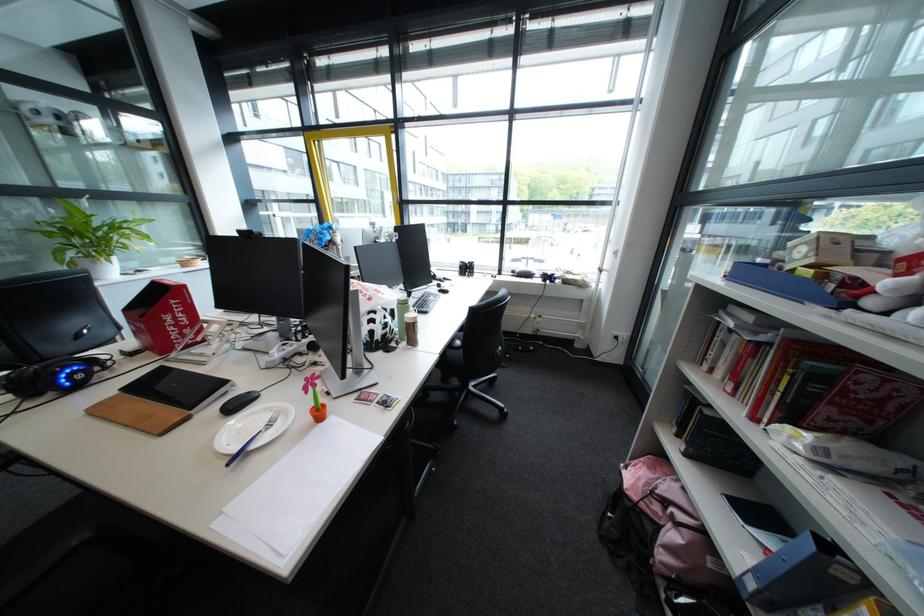
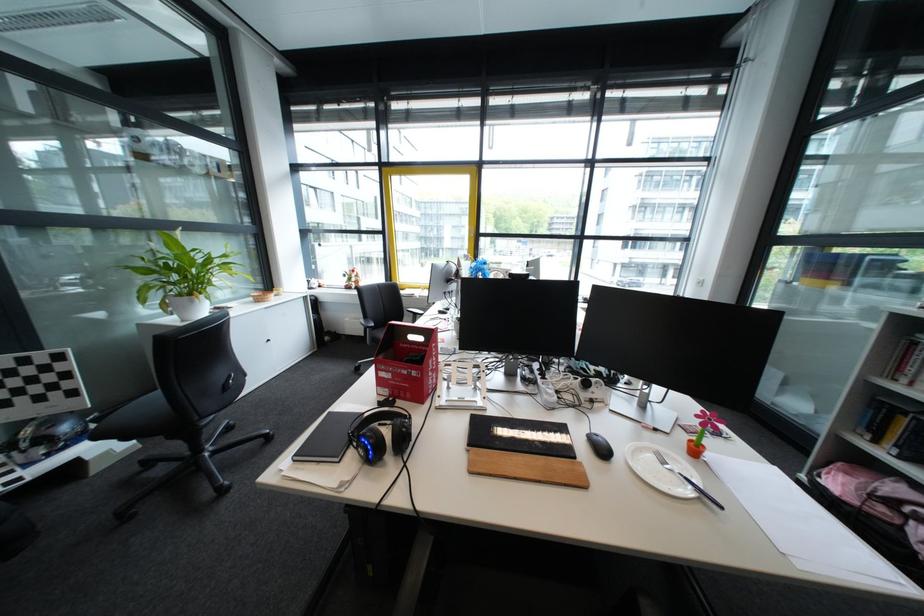
Find the pixel in the second image that matches (108,264) in the first image.

(207, 302)